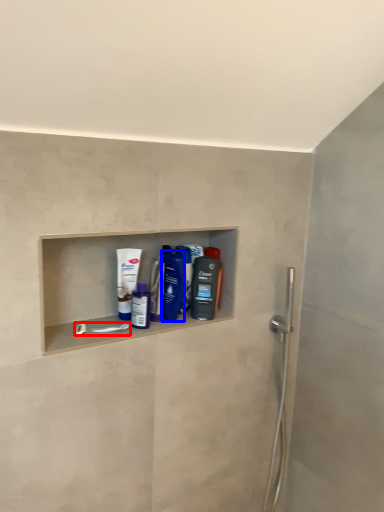
Question: Which of the following is the farthest to the observer, towel bar (highlighted by a red box) or mouthwash (highlighted by a blue box)?

Choices:
 (A) towel bar
 (B) mouthwash

Answer: (B)